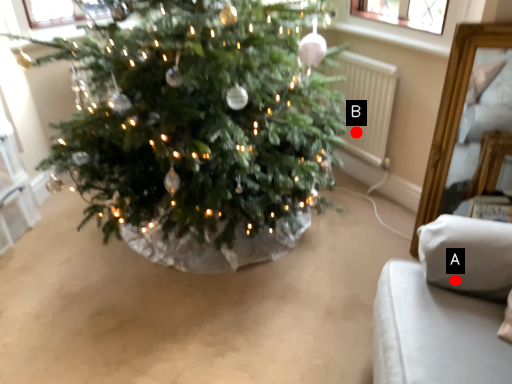
Question: Two points are circled on the image, labeled by A and B beside each circle. Which point is closer to the camera?

Choices:
 (A) A is closer
 (B) B is closer

Answer: (A)